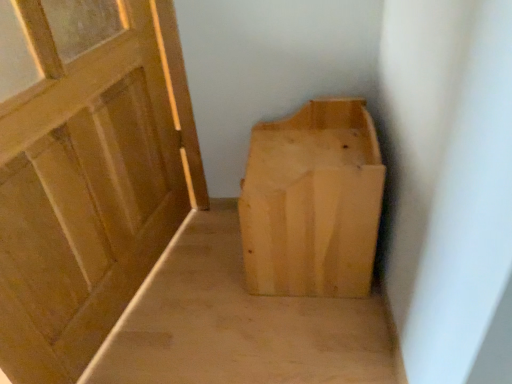
At what (x,y) coordinates should I click in order to perform the action: click on free space between light wood/rough textured box at center and matte wood door at left. Please return your answer as a coordinate pair (x, y). The width and height of the screenshot is (512, 384). Looking at the image, I should click on (211, 297).